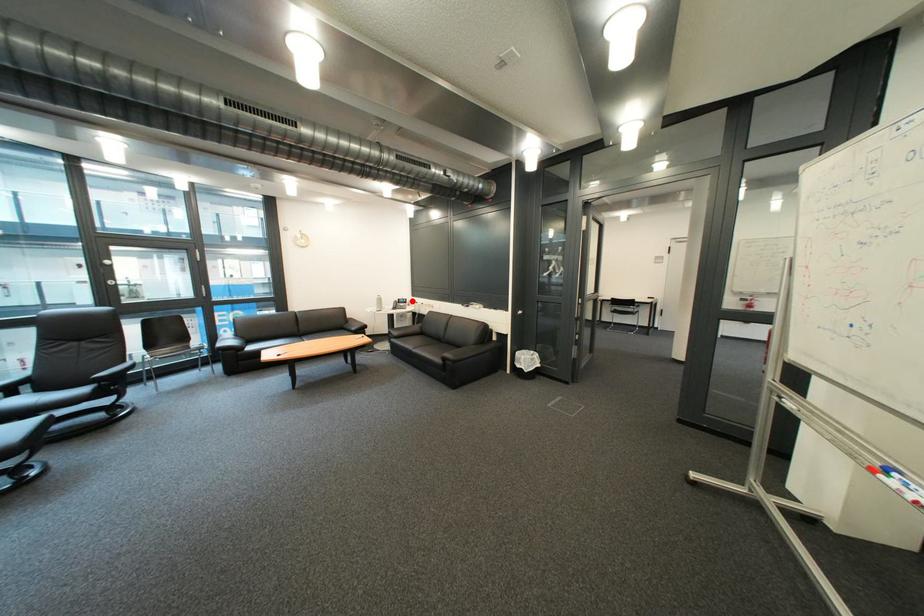
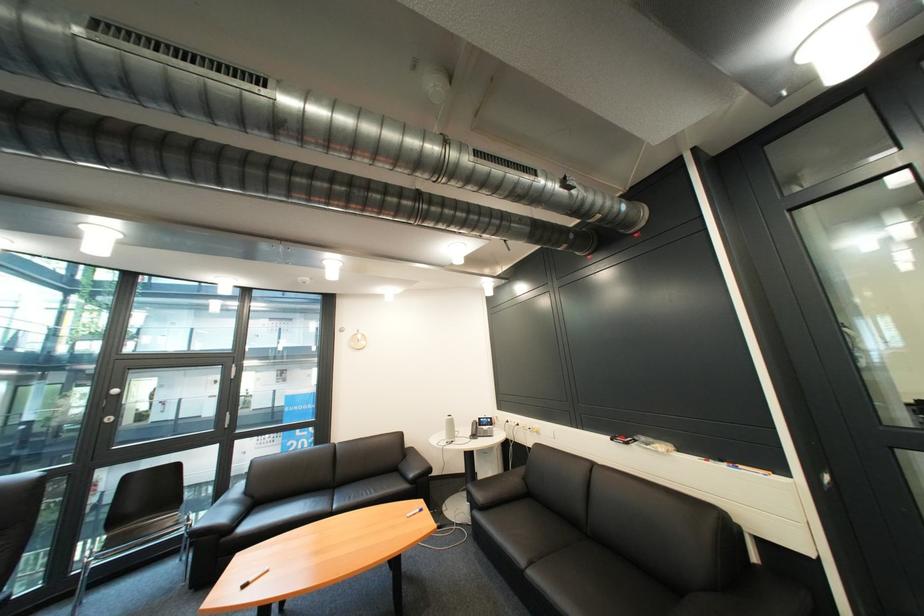
Find the pixel in the second image that matches the highlighted location in the first image.

(492, 419)